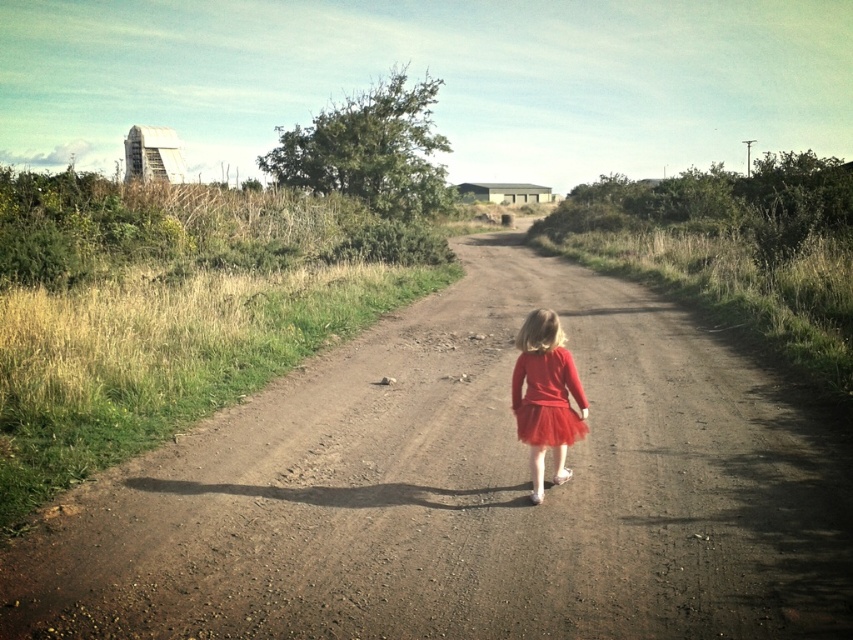
You are a photographer trying to capture a shot of the brown dirt track at center and the red tulle skirt at center. You want to ensure both are in focus. Given that your camera can only focus on objects within a 10 feet range, will both objects be in focus?

The brown dirt track at center and red tulle skirt at center are 11.85 feet apart from each other. Since the distance between them exceeds the camera focus range of 10 feet, both objects cannot be in focus simultaneously.

You are a photographer aiming to capture the girl in her red tulle skirt at center walking along the brown dirt track at center. To ensure the skirt is in focus while the track remains visible in the background, where should you position the focus point of your camera?

The brown dirt track at center is positioned on the right side of the red tulle skirt at center, so you should focus on the red tulle skirt at center to keep it sharp while the track stays in the background.

You are a photographer trying to capture the girl in the red tulle skirt at center. The brown dirt track at center is in the background. If you want to focus on the skirt, should you adjust the camera to focus on a closer or farther subject?

The brown dirt track at center is much taller than the red tulle skirt at center. To focus on the skirt, adjust the camera to focus on a closer subject since the skirt is nearer to the camera compared to the taller dirt track in the background.